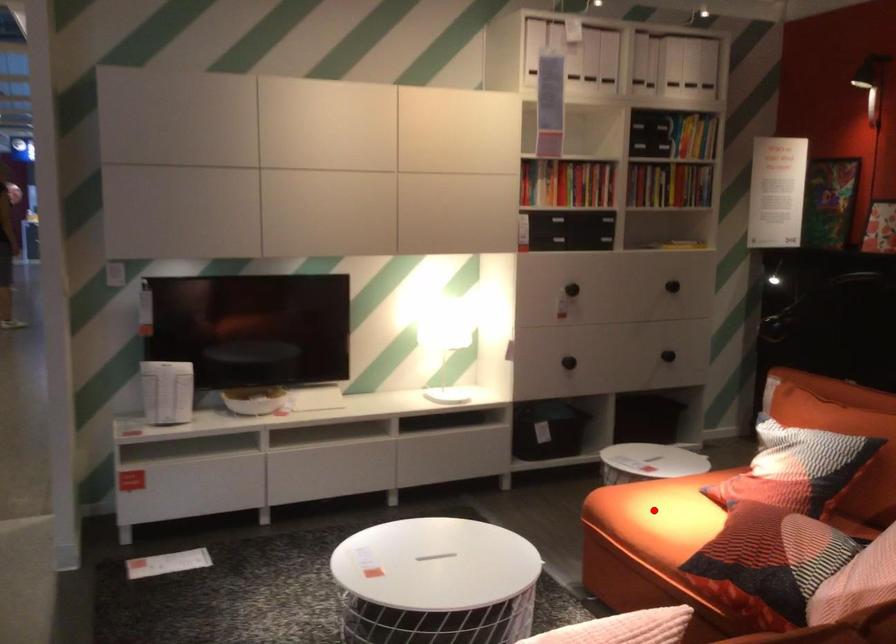
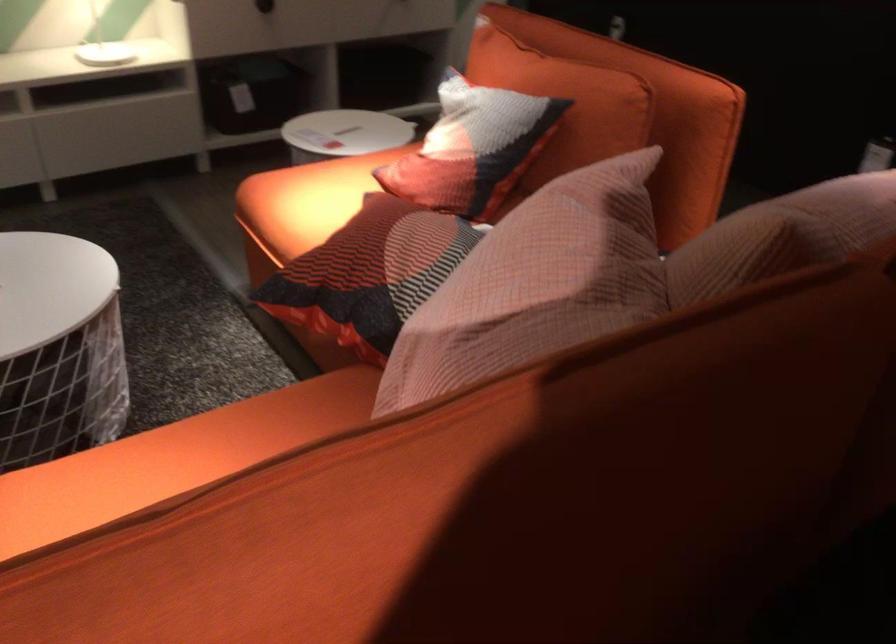
Question: I am providing you with two images of the same scene from different viewpoints. Image1 has a red point marked. In image2, the corresponding 3D location appears at what relative position? Reply with the corresponding letter.

Choices:
 (A) Closer
 (B) Farther

Answer: (A)